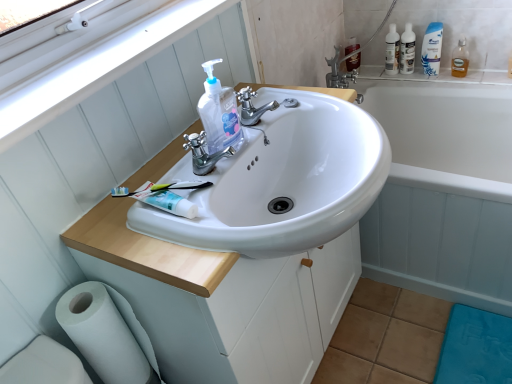
Image resolution: width=512 pixels, height=384 pixels. I want to click on vacant space positioned to the left of white glossy toothpaste at center, so click(112, 217).